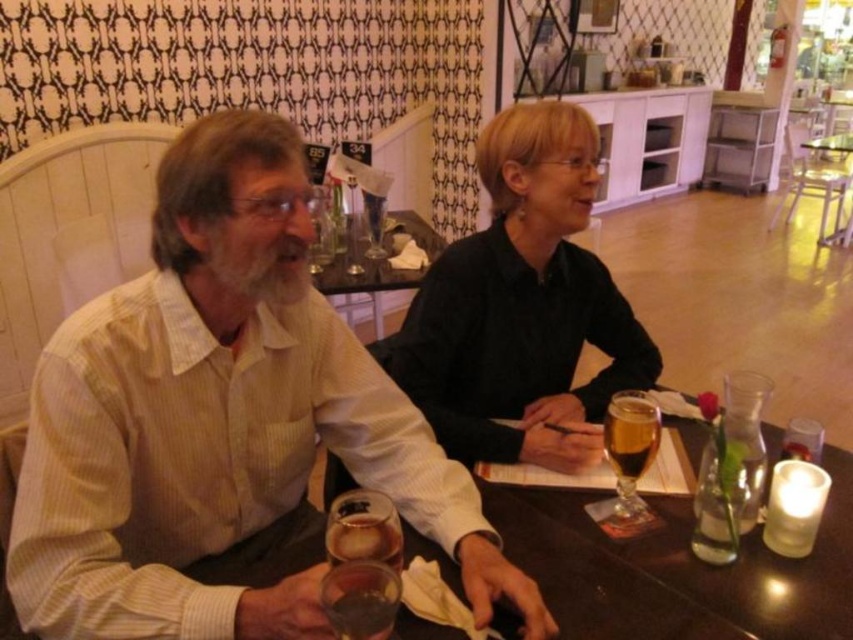
Is point (340, 538) in front of point (369, 220)?

Yes, point (340, 538) is in front of point (369, 220).

Does point (360, 538) come farther from viewer compared to point (374, 234)?

No.

Who is more forward, (341, 522) or (366, 200)?

Point (341, 522)

Where is `translucent glass wine glass at center`? The height and width of the screenshot is (640, 853). translucent glass wine glass at center is located at coordinates pos(363,529).

Who is positioned more to the left, smooth wooden table at center or clear glass wine glass at upper center?

clear glass wine glass at upper center is more to the left.

Who is more distant from viewer, (689, 577) or (369, 250)?

The point (369, 250) is more distant.

Does point (548, 600) come farther from viewer compared to point (370, 218)?

That is False.

Where is `smooth wooden table at center`? This screenshot has height=640, width=853. smooth wooden table at center is located at coordinates (676, 570).

The height and width of the screenshot is (640, 853). Describe the element at coordinates (523, 307) in the screenshot. I see `black matte shirt at center` at that location.

Find the location of `black matte shirt at center`. black matte shirt at center is located at coordinates (523, 307).